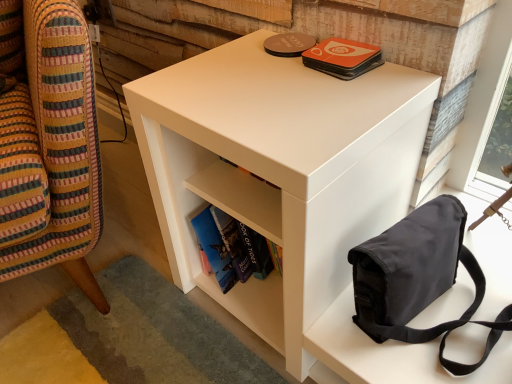
Where is `blank area beneath white matte side table at lower right (from a real-world perspective)`? The width and height of the screenshot is (512, 384). blank area beneath white matte side table at lower right (from a real-world perspective) is located at coordinates (93, 261).